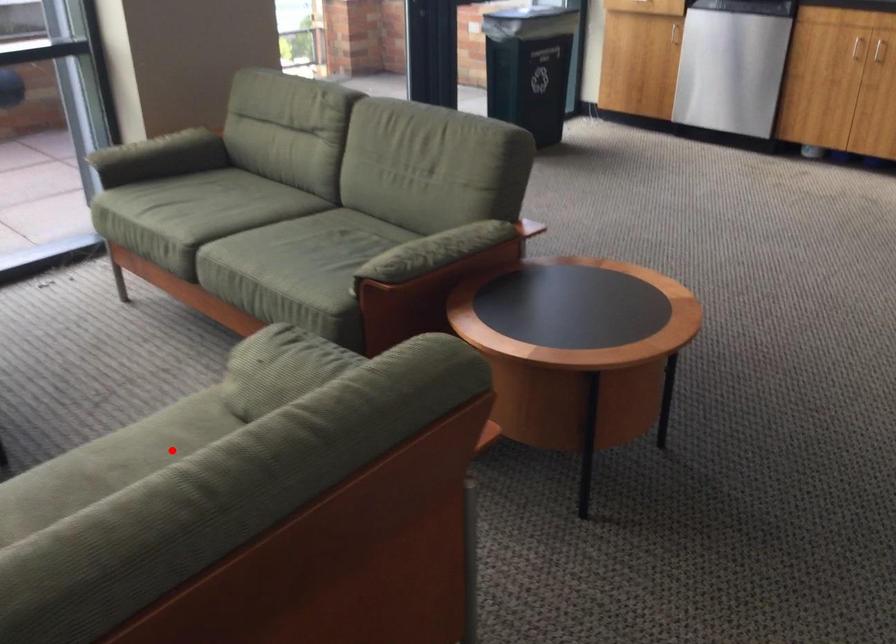
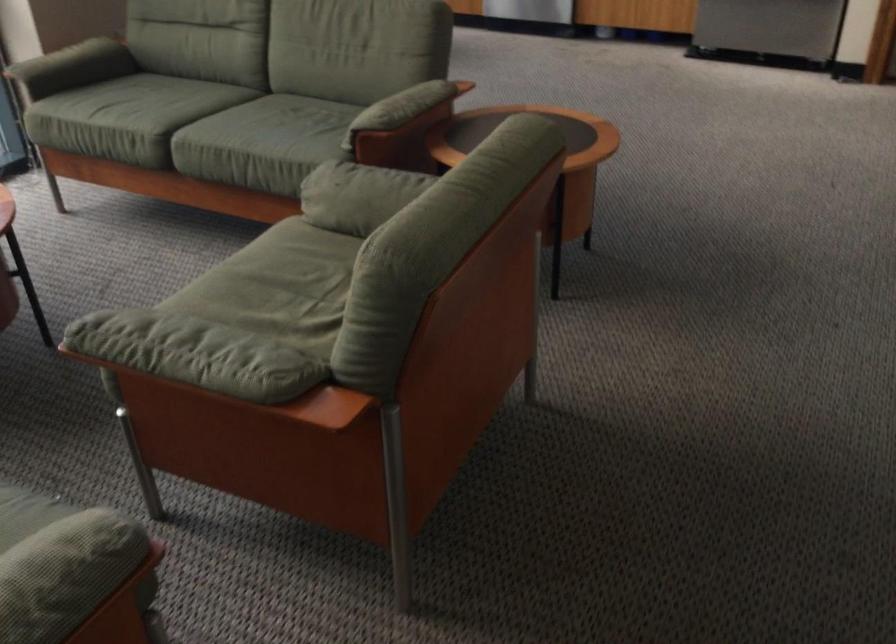
Question: I am providing you with two images of the same scene from different viewpoints. A red point is shown in image1. For the corresponding object point in image2, is it positioned nearer or farther from the camera?

Choices:
 (A) Nearer
 (B) Farther

Answer: (B)